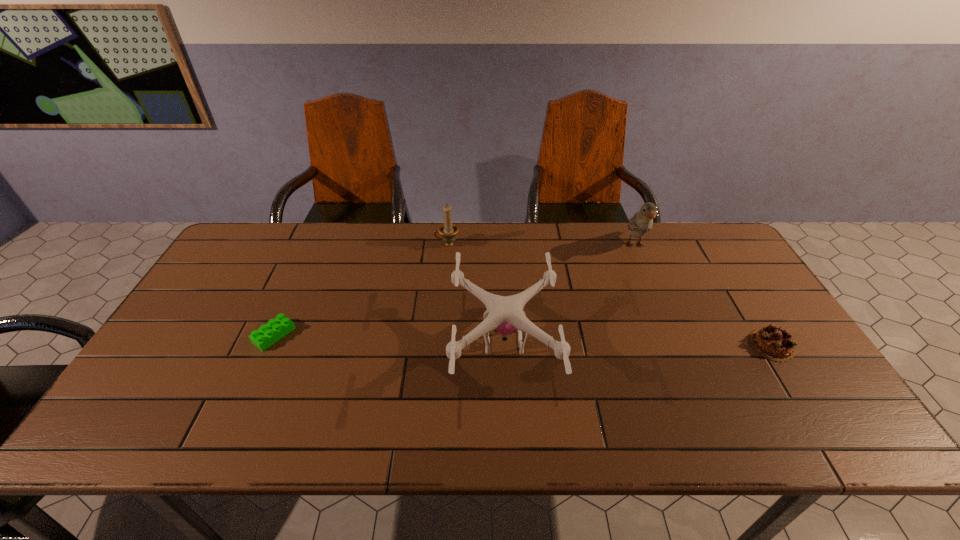
The height and width of the screenshot is (540, 960). Identify the location of free spot located 0.340m on the handle side of the candle_holder. (333, 244).

Locate an element on the screen. free location located on the handle side of the candle_holder is located at coordinates (366, 244).

Where is `vacant area situated 0.120m on the top of the drone`? Image resolution: width=960 pixels, height=540 pixels. vacant area situated 0.120m on the top of the drone is located at coordinates (405, 342).

This screenshot has height=540, width=960. I want to click on free location located on the top of the drone, so click(x=323, y=342).

Locate an element on the screen. Image resolution: width=960 pixels, height=540 pixels. vacant space situated on the top of the drone is located at coordinates (383, 342).

The image size is (960, 540). What are the coordinates of `free spot located 0.110m on the left of the fourth tallest object` in the screenshot? It's located at (708, 345).

The width and height of the screenshot is (960, 540). I want to click on vacant space located on the front of the Lego, so click(x=246, y=399).

Find the location of a particular element. The height and width of the screenshot is (540, 960). bird that is at the far edge is located at coordinates (642, 222).

Find the location of a particular element. The image size is (960, 540). candle_holder present at the far edge is located at coordinates (448, 230).

This screenshot has width=960, height=540. What are the coordinates of `object situated at the near edge` in the screenshot? It's located at (504, 314).